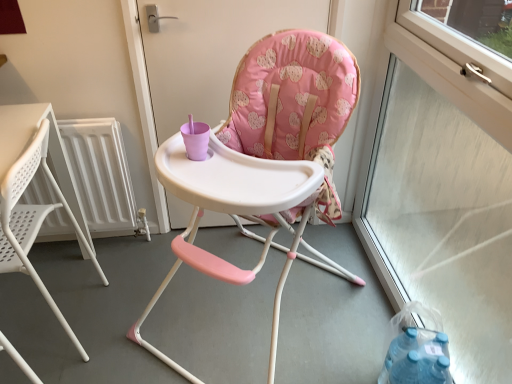
At what (x,y) coordinates should I click in order to perform the action: click on spots to the right of white metallic radiator at left. Please return your answer as a coordinate pair (x, y). The image size is (512, 384). Looking at the image, I should click on click(148, 264).